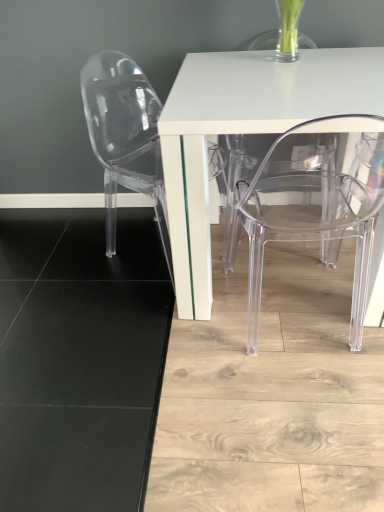
In order to click on free spot to the left of white glossy table at center in this screenshot , I will do `click(92, 298)`.